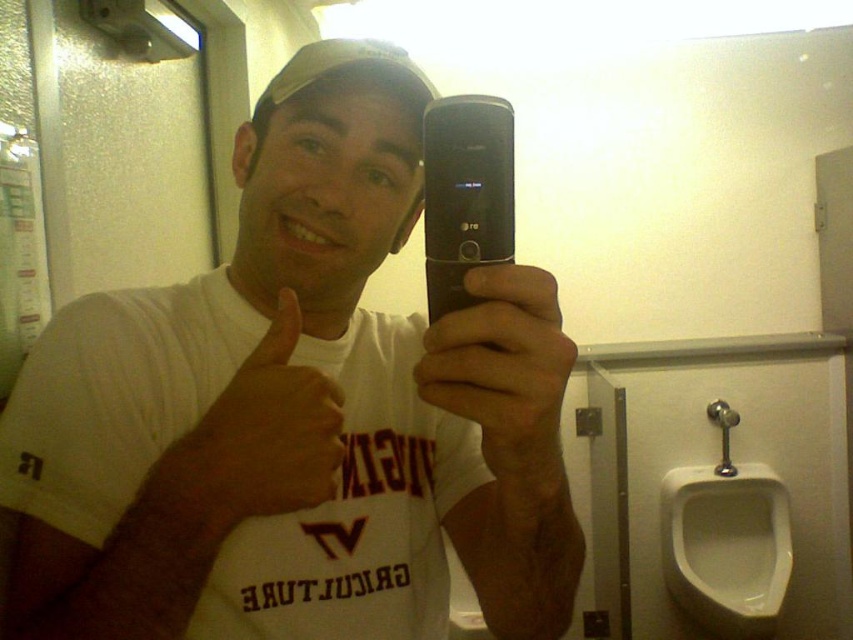
Is white matte t-shirt at center above black plastic phone at center?

No.

Identify the location of white matte t-shirt at center. (297, 412).

Is white glossy urinal at lower right to the left of black plastic phone at center from the viewer's perspective?

Incorrect, white glossy urinal at lower right is not on the left side of black plastic phone at center.

Can you confirm if white glossy urinal at lower right is positioned below black plastic phone at center?

Yes, white glossy urinal at lower right is below black plastic phone at center.

Which is behind, point (762, 515) or point (456, 160)?

The point (762, 515) is more distant.

The image size is (853, 640). Find the location of `white glossy urinal at lower right`. white glossy urinal at lower right is located at coordinates (726, 547).

How distant is skinny white hand at upper center from black plastic phone at center?

A distance of 4.43 inches exists between skinny white hand at upper center and black plastic phone at center.

Who is more distant from viewer, (293, 301) or (480, 195)?

The point (293, 301) is behind.

Does point (201, 484) lie in front of point (469, 257)?

That is False.

The image size is (853, 640). What are the coordinates of `skinny white hand at upper center` in the screenshot? It's located at 256,440.